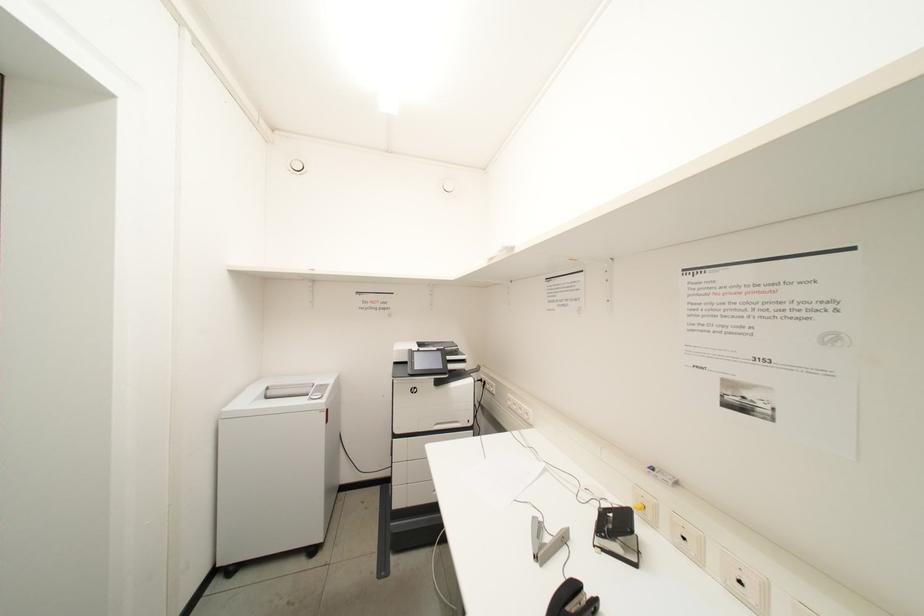
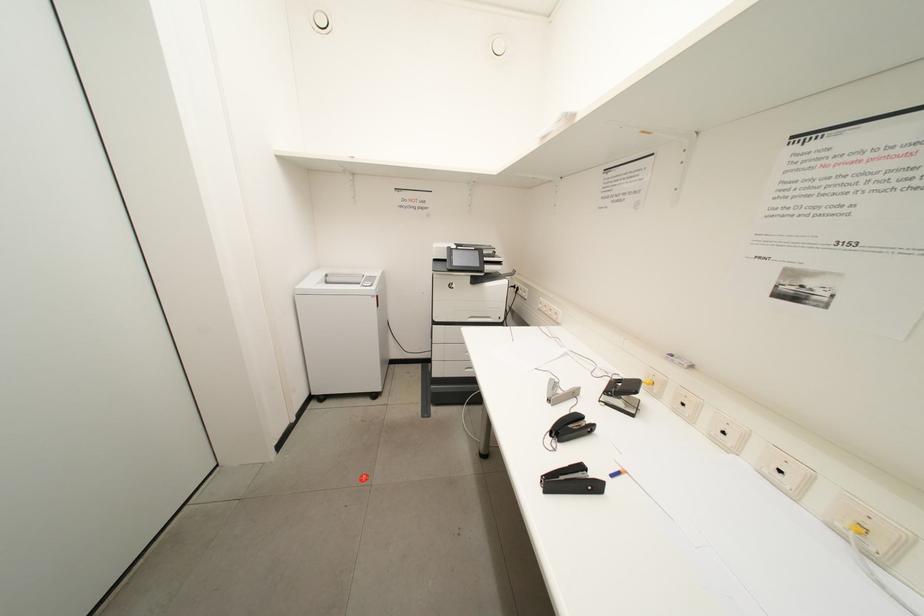
Question: In a continuous first-person perspective shot, in which direction is the camera moving?

Choices:
 (A) Left
 (B) Right
 (C) Forward
 (D) Backward

Answer: (D)